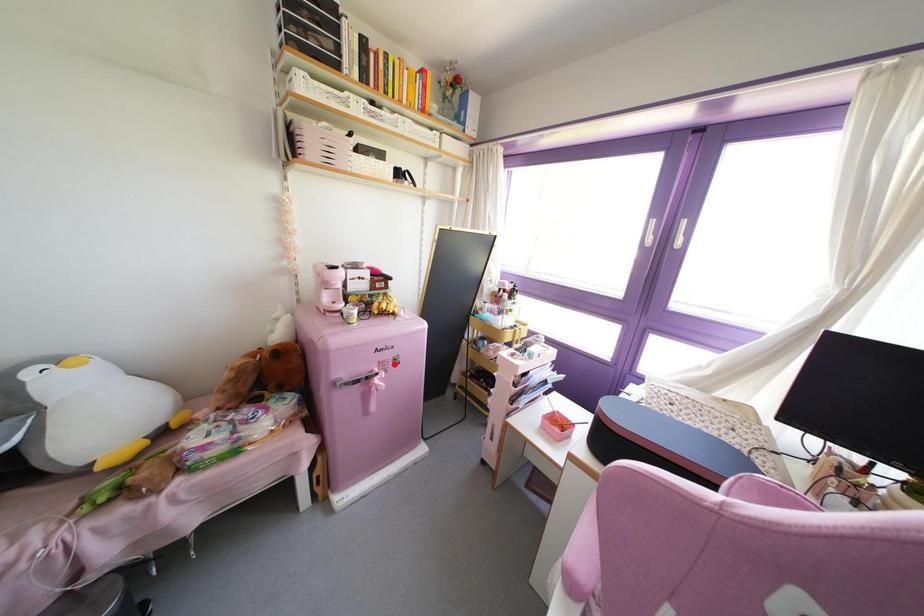
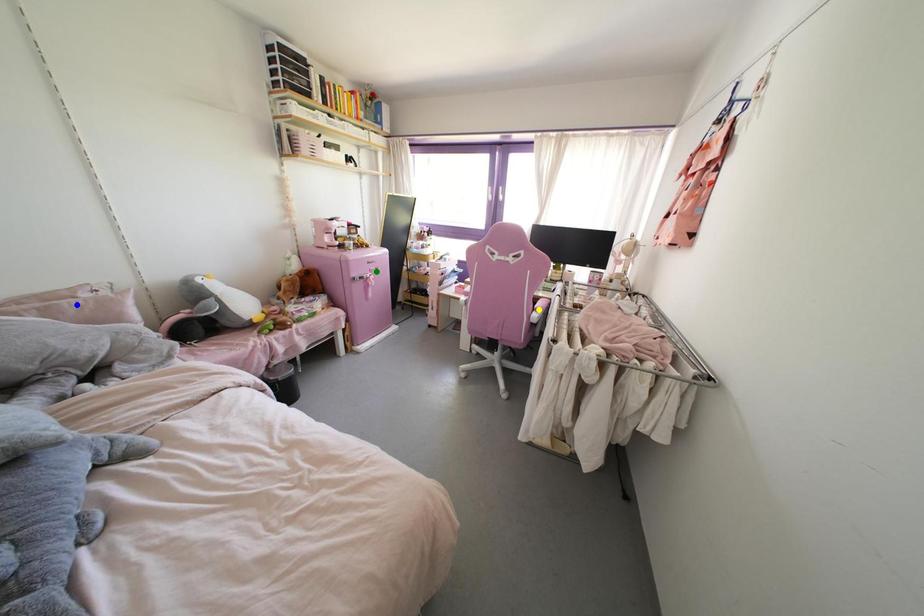
Question: I am providing you with two images of the same scene from different viewpoints. A red point is marked on the first image. You are given multiple points on the second image. Which point in image 2 is actually the same real-world point as the red point in image 1?

Choices:
 (A) green point
 (B) yellow point
 (C) blue point

Answer: (A)